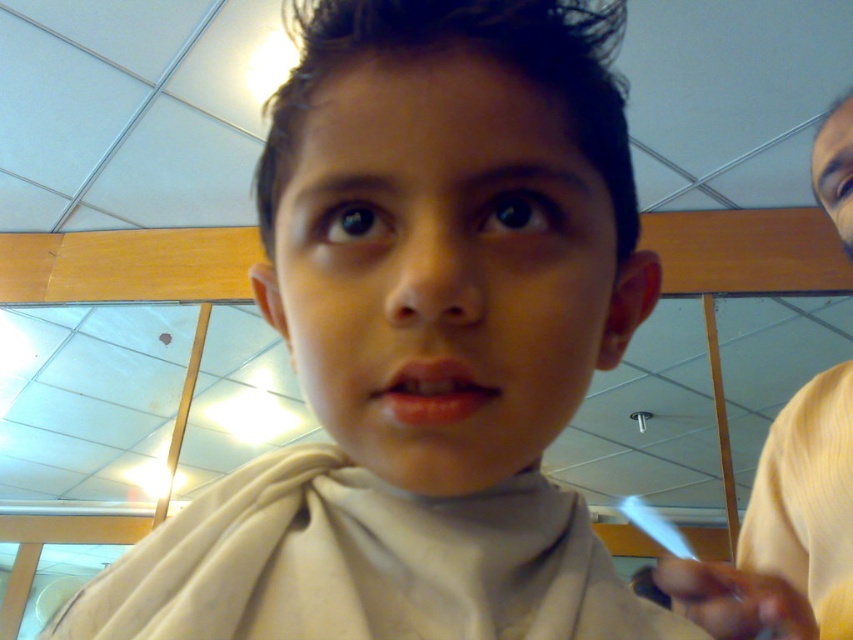
Question: Considering the relative positions of yellow fabric shirt at right and smooth pink lips at center in the image provided, where is yellow fabric shirt at right located with respect to smooth pink lips at center?

Choices:
 (A) below
 (B) above

Answer: (A)

Question: Among these objects, which one is farthest from the camera?

Choices:
 (A) smooth pink lips at center
 (B) yellow fabric shirt at right

Answer: (B)

Question: Does yellow fabric shirt at right appear on the right side of smooth pink lips at center?

Choices:
 (A) yes
 (B) no

Answer: (A)

Question: Does yellow fabric shirt at right appear over smooth pink lips at center?

Choices:
 (A) no
 (B) yes

Answer: (A)